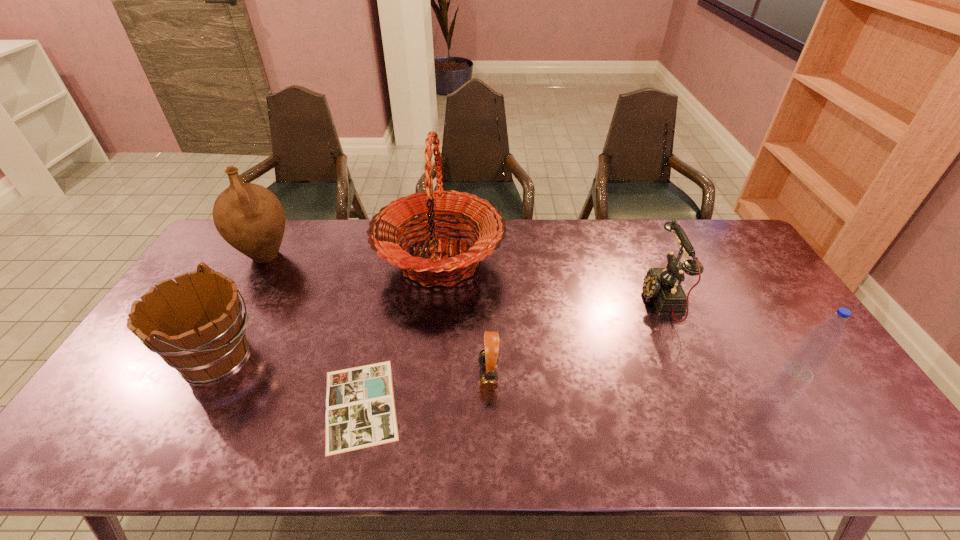
I want to click on object located at the near edge, so click(360, 409).

Locate an element on the screen. pitcher that is at the left edge is located at coordinates (249, 217).

At what (x,y) coordinates should I click in order to perform the action: click on wine bucket present at the left edge. Please return your answer as a coordinate pair (x, y). Looking at the image, I should click on (195, 325).

Locate an element on the screen. object that is positioned at the right edge is located at coordinates (811, 355).

This screenshot has height=540, width=960. I want to click on object that is at the far left corner, so click(249, 217).

Locate an element on the screen. Image resolution: width=960 pixels, height=540 pixels. blank area at the far edge is located at coordinates (x=692, y=259).

Where is `vacant area at the near edge`? The width and height of the screenshot is (960, 540). vacant area at the near edge is located at coordinates (674, 428).

I want to click on vacant point at the left edge, so click(218, 271).

Where is `vacant area at the right edge of the desktop`? This screenshot has height=540, width=960. vacant area at the right edge of the desktop is located at coordinates (817, 379).

In the image, there is a desktop. At what (x,y) coordinates should I click in order to perform the action: click on vacant space at the near right corner. Please return your answer as a coordinate pair (x, y). This screenshot has width=960, height=540. Looking at the image, I should click on (876, 428).